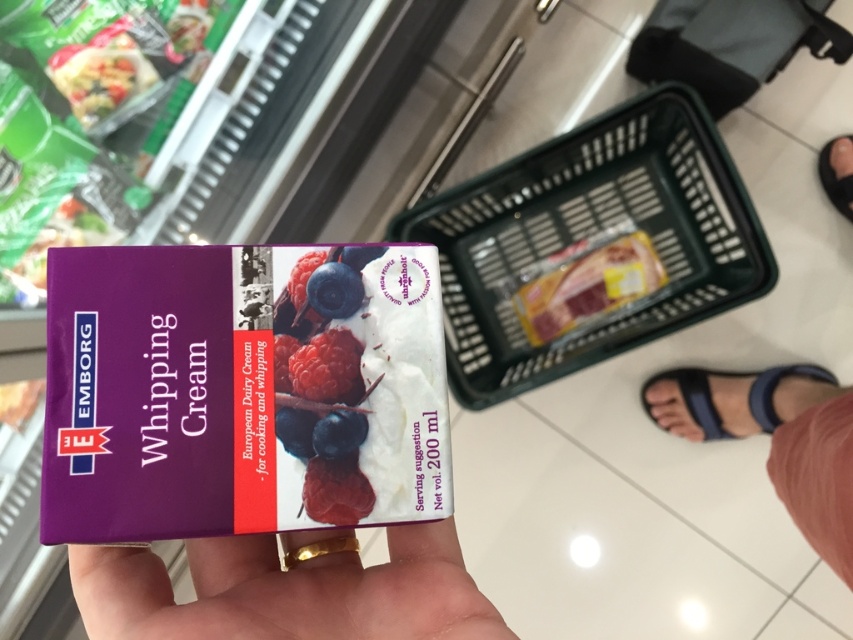
Question: Which of the following is the closest to the observer?

Choices:
 (A) (142, 620)
 (B) (280, 337)

Answer: (A)

Question: From the image, what is the correct spatial relationship of raspberry at center in relation to blue matte/blueberry at center?

Choices:
 (A) left
 (B) right

Answer: (A)

Question: Is purple matte whipped cream at center above black rubber sandal at lower right?

Choices:
 (A) yes
 (B) no

Answer: (B)

Question: Which object is closer to the camera taking this photo?

Choices:
 (A) purple matte whipped cream at center
 (B) black rubber sandal at lower right

Answer: (A)

Question: Which object is positioned farthest from the black rubber sandal at lower right?

Choices:
 (A) blueberry matte at center
 (B) green plastic shopping basket at center

Answer: (A)

Question: Does purple matte whipped cream at center have a lesser width compared to blue fabric sandal at lower right?

Choices:
 (A) no
 (B) yes

Answer: (B)